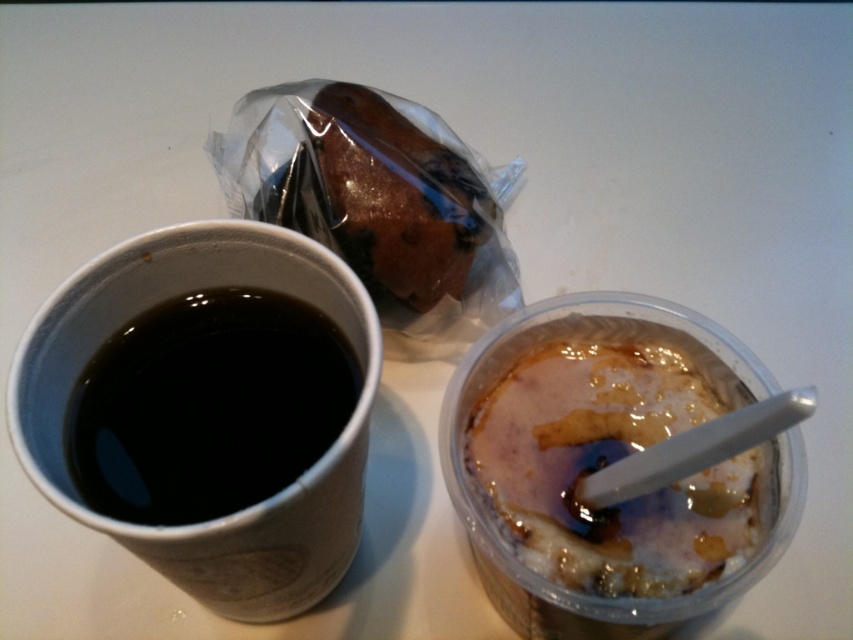
Question: Estimate the real-world distances between objects in this image. Which object is farther from the black paper cup at left?

Choices:
 (A) spongy white cake at center
 (B) brown/crumbly pastry at upper center
 (C) black matte cup at left

Answer: (B)

Question: Which point is closer to the camera?

Choices:
 (A) (x=698, y=477)
 (B) (x=306, y=413)
 (C) (x=361, y=323)

Answer: (C)

Question: Is spongy white cake at center above brown/crumbly pastry at upper center?

Choices:
 (A) no
 (B) yes

Answer: (A)

Question: Which point is farther to the camera?

Choices:
 (A) (317, 324)
 (B) (13, 390)
 (C) (355, 225)
 (D) (657, 426)

Answer: (C)

Question: Can you confirm if black paper cup at left is positioned to the right of spongy white cake at center?

Choices:
 (A) no
 (B) yes

Answer: (A)

Question: Does black paper cup at left appear on the right side of brown/crumbly pastry at upper center?

Choices:
 (A) yes
 (B) no

Answer: (B)